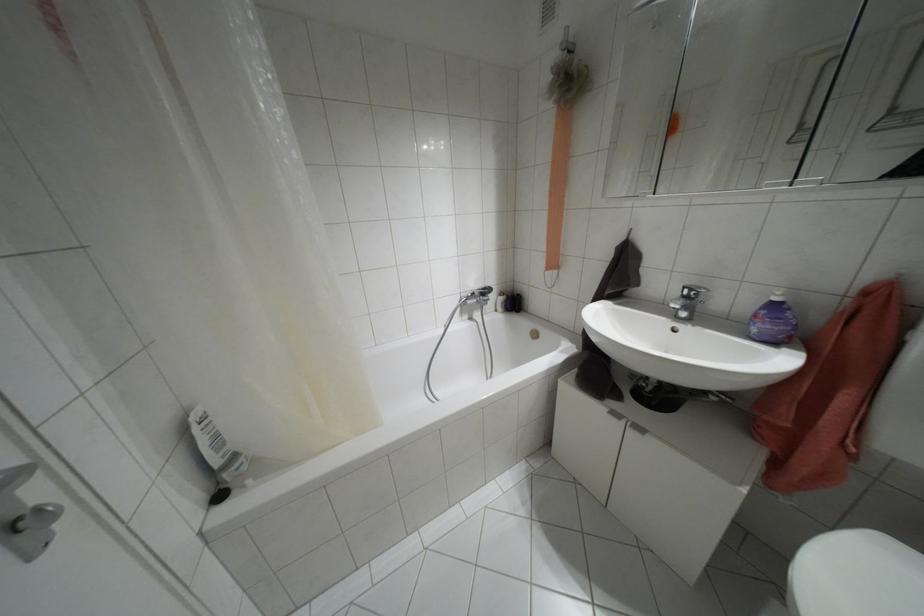
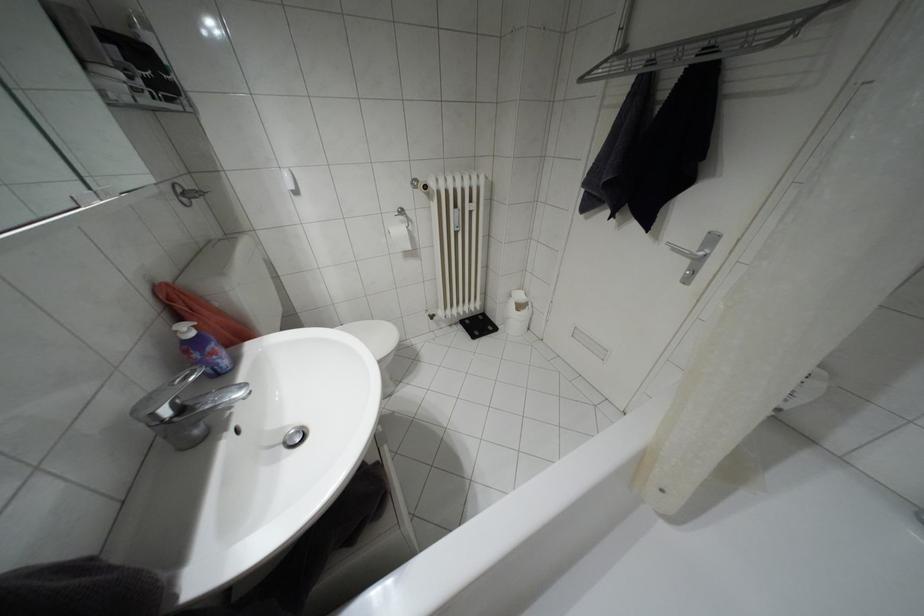
Where in the second image is the point corresponding to point 686,297 from the first image?

(180, 408)